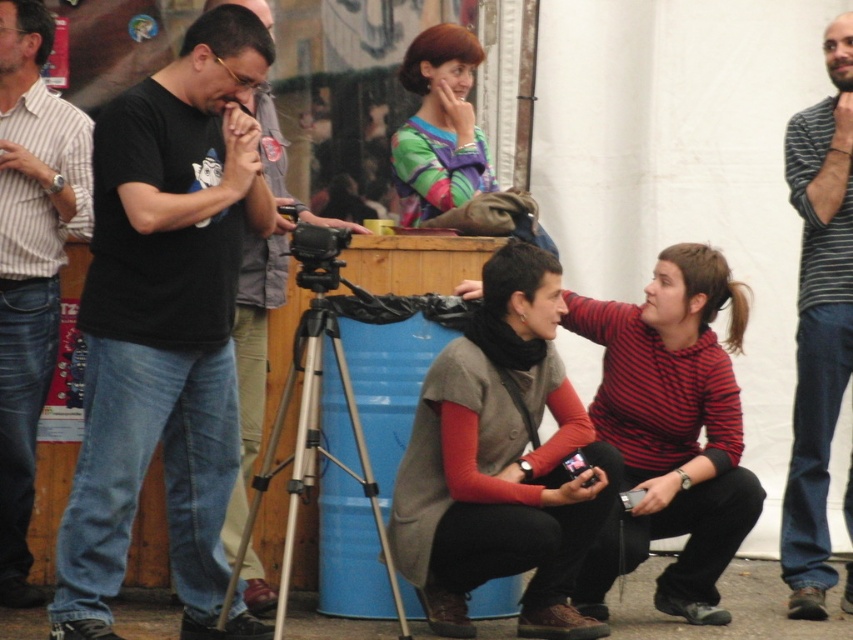
Is knit sweater at center in front of black plastic video camera at center?

Yes, knit sweater at center is closer to the viewer.

Consider the image. Is knit sweater at center shorter than black plastic video camera at center?

In fact, knit sweater at center may be taller than black plastic video camera at center.

Is point (494, 266) closer to viewer compared to point (318, 225)?

No, (494, 266) is behind (318, 225).

Image resolution: width=853 pixels, height=640 pixels. In order to click on knit sweater at center in this screenshot , I will do `click(502, 461)`.

Is striped cotton shirt at right shorter than silver metallic tripod at center?

No.

Measure the distance between point [834,186] and camera.

Point [834,186] and camera are 33.28 feet apart.

Where is `striped cotton shirt at right`? The height and width of the screenshot is (640, 853). striped cotton shirt at right is located at coordinates (817, 320).

Can you confirm if striped cotton shirt at left is taller than striped cotton shirt at right?

Incorrect, striped cotton shirt at left's height is not larger of striped cotton shirt at right's.

Is point (4, 109) positioned in front of point (813, 506)?

Yes.

Locate an element on the screen. striped cotton shirt at left is located at coordinates (32, 262).